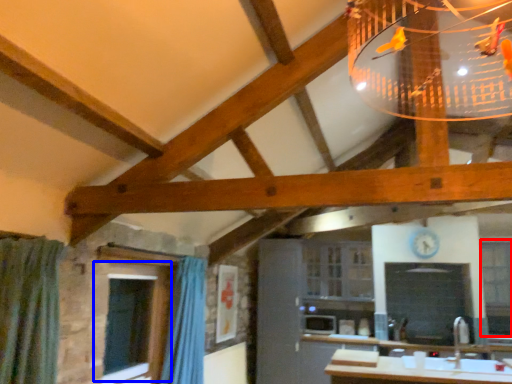
Question: Among these objects, which one is nearest to the camera, window (highlighted by a red box) or window (highlighted by a blue box)?

Choices:
 (A) window
 (B) window

Answer: (B)